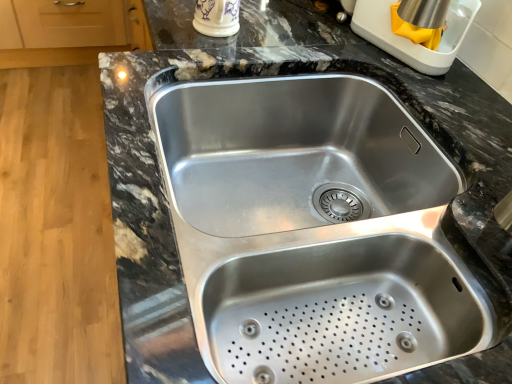
The height and width of the screenshot is (384, 512). What are the coordinates of `blank area to the left of stainless steel kettle at upper right, the second appliance when ordered from left to right` in the screenshot? It's located at (321, 49).